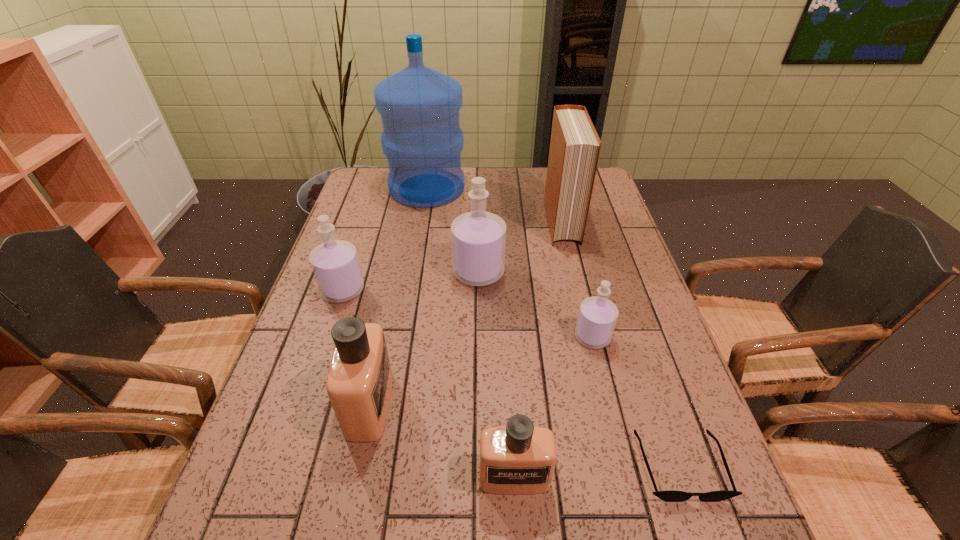
I want to click on free space located 0.260m on the left of the fourth nearest object, so click(468, 337).

Where is `vacant space located on the front-facing side of the black sunglasses`? vacant space located on the front-facing side of the black sunglasses is located at coordinates (705, 539).

Locate an element on the screen. object at the far edge is located at coordinates (422, 139).

The width and height of the screenshot is (960, 540). In order to click on water jug at the left edge in this screenshot , I will do `click(422, 139)`.

At what (x,y) coordinates should I click in order to perform the action: click on perfume at the left edge. Please return your answer as a coordinate pair (x, y). Looking at the image, I should click on (335, 264).

Image resolution: width=960 pixels, height=540 pixels. I want to click on hardback book located in the right edge section of the desktop, so click(x=574, y=151).

The height and width of the screenshot is (540, 960). I want to click on perfume at the right edge, so click(x=597, y=317).

I want to click on sunglasses that is at the right edge, so click(670, 496).

Locate an element on the screen. object positioned at the far left corner is located at coordinates (422, 139).

Image resolution: width=960 pixels, height=540 pixels. Identify the location of vacant space at the far edge of the desktop. (512, 181).